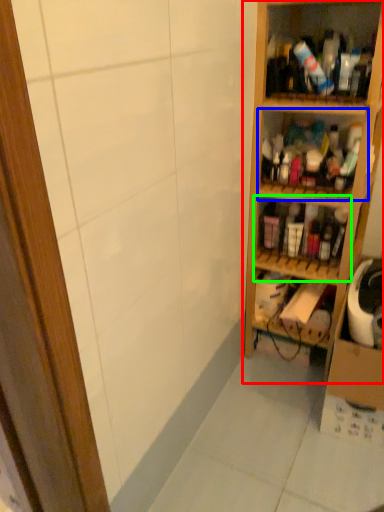
Question: Based on their relative distances, which object is farther from shelf (highlighted by a red box)? Choose from shelf (highlighted by a blue box) and shelf (highlighted by a green box).

Choices:
 (A) shelf
 (B) shelf

Answer: (B)